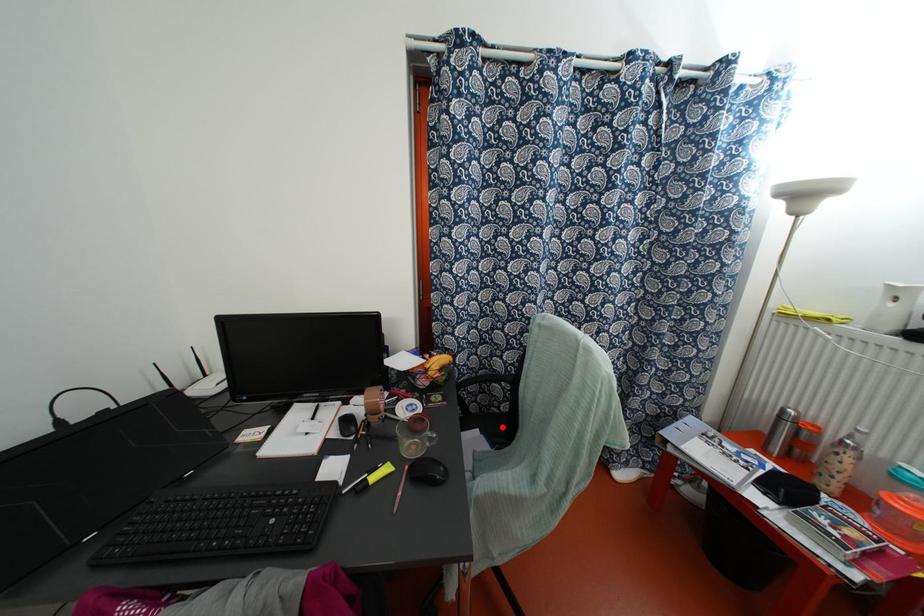
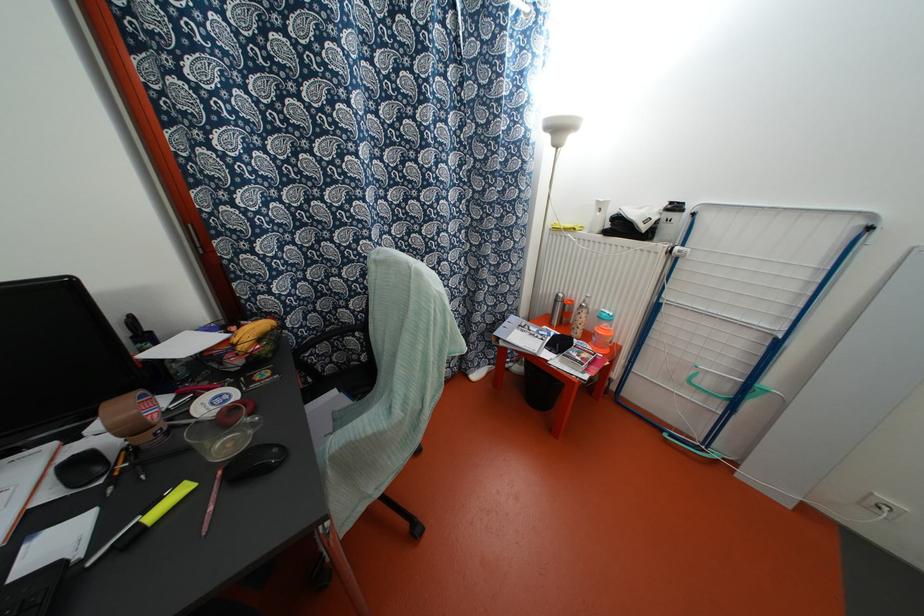
Question: I am providing you with two images of the same scene from different viewpoints. A red point is shown in image1. For the corresponding object point in image2, is it positioned nearer or farther from the camera?

Choices:
 (A) Nearer
 (B) Farther

Answer: (B)